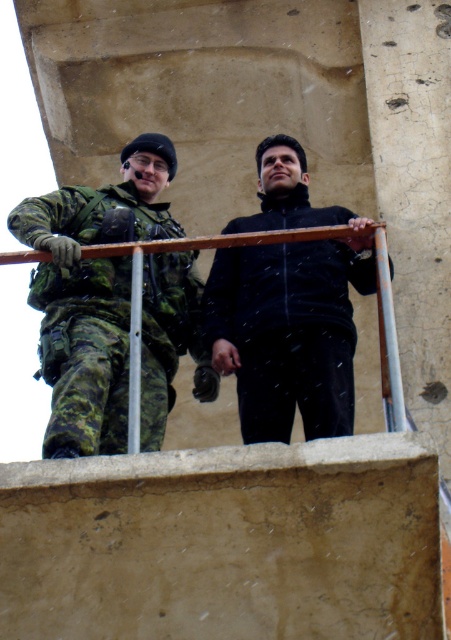
Question: Does camouflage fabric uniform at left appear under black matte jacket at center?

Choices:
 (A) yes
 (B) no

Answer: (B)

Question: In this image, where is camouflage fabric uniform at left located relative to black matte jacket at center?

Choices:
 (A) left
 (B) right

Answer: (A)

Question: Which point is farther from the camera taking this photo?

Choices:
 (A) (122, 224)
 (B) (284, 339)

Answer: (A)

Question: Among these objects, which one is farthest from the camera?

Choices:
 (A) black matte jacket at center
 (B) camouflage fabric uniform at left

Answer: (A)

Question: Is camouflage fabric uniform at left wider than black matte jacket at center?

Choices:
 (A) no
 (B) yes

Answer: (B)